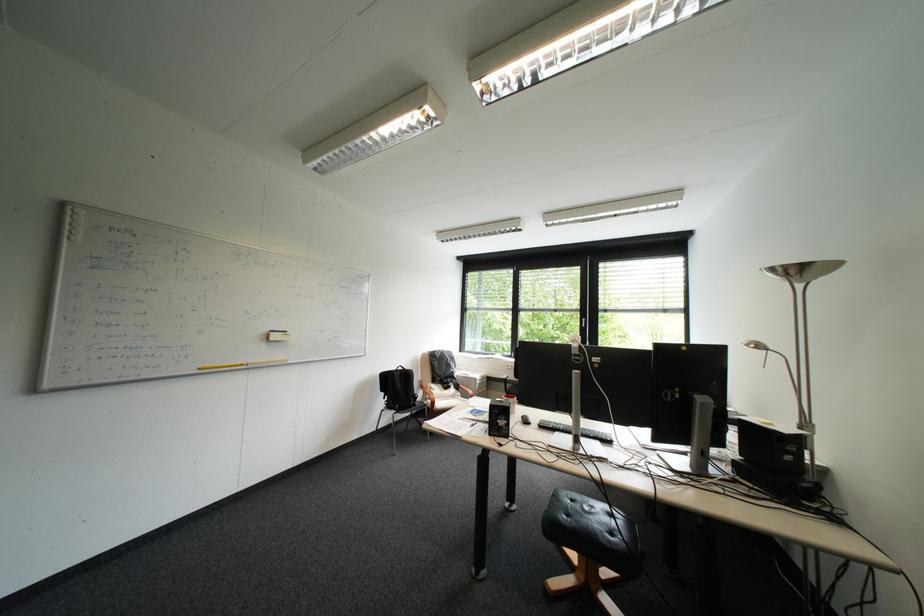
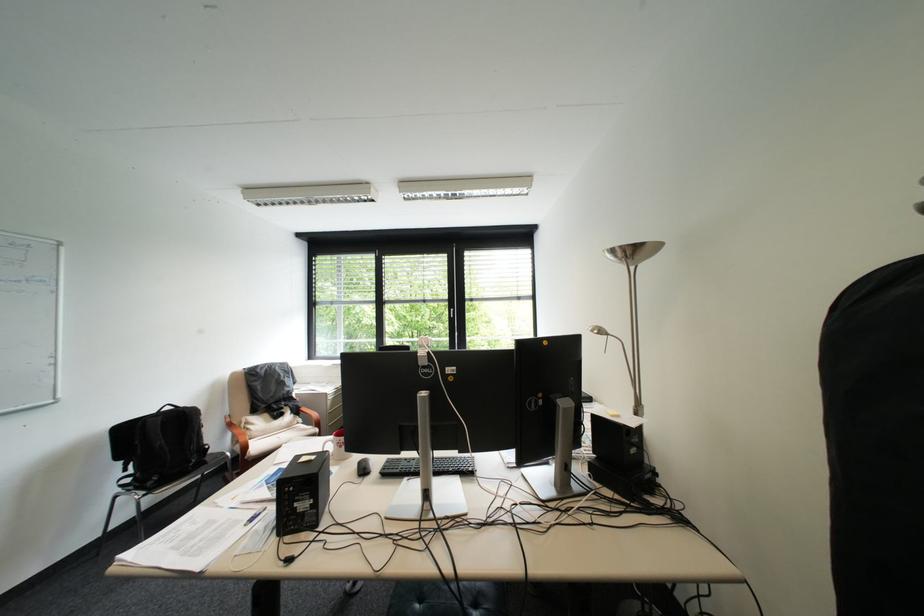
Locate, in the second image, the point that corresponds to point 532,419 in the first image.

(369, 467)